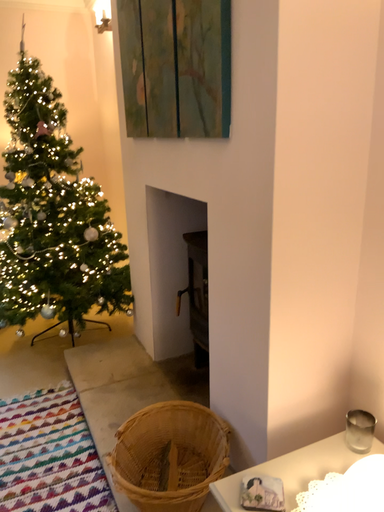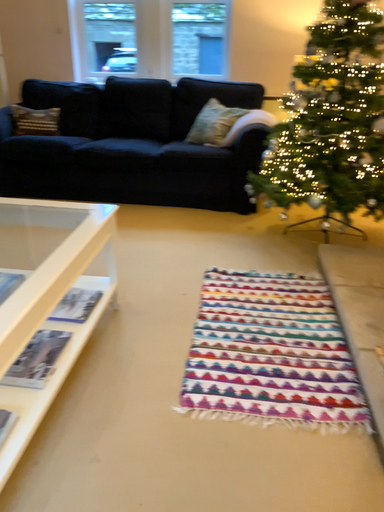
Question: How did the camera likely rotate when shooting the video?

Choices:
 (A) rotated downward
 (B) rotated upward

Answer: (A)